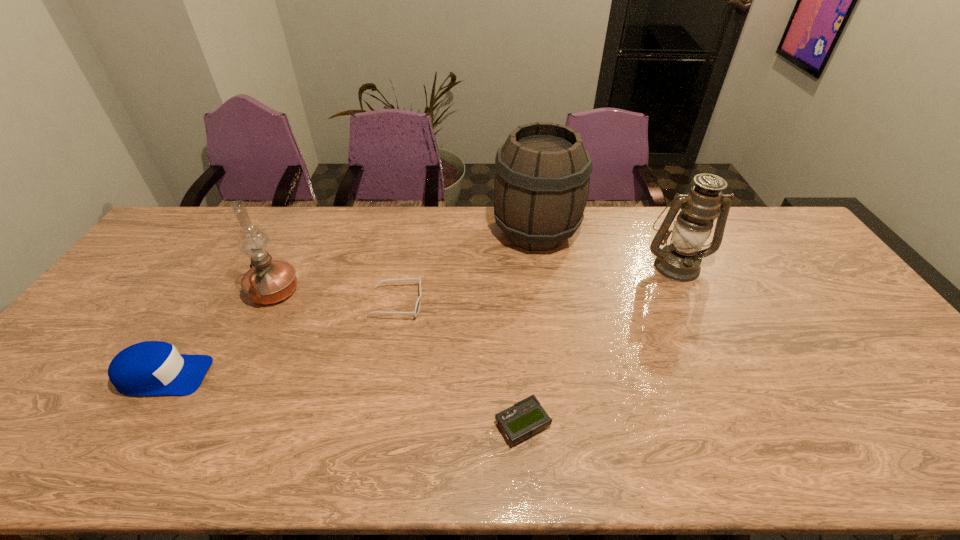
Where is `vacant space at the right edge of the desktop`? This screenshot has width=960, height=540. vacant space at the right edge of the desktop is located at coordinates (895, 401).

I want to click on free point at the far left corner, so [x=182, y=231].

I want to click on vacant space at the far right corner of the desktop, so (758, 243).

The width and height of the screenshot is (960, 540). Find the location of `free point between the third object from left to right and the fourth tallest object`. free point between the third object from left to right and the fourth tallest object is located at coordinates (280, 339).

This screenshot has height=540, width=960. Find the location of `vacant area between the rightmost object and the wine bucket`. vacant area between the rightmost object and the wine bucket is located at coordinates tap(606, 249).

Find the location of `vacant space that is in between the left oil lamp and the wine bucket`. vacant space that is in between the left oil lamp and the wine bucket is located at coordinates (405, 262).

What are the coordinates of `free space between the second shortest object and the right oil lamp` in the screenshot? It's located at (537, 284).

This screenshot has width=960, height=540. What are the coordinates of `free point between the sunglasses and the shortest object` in the screenshot? It's located at pyautogui.click(x=460, y=363).

What are the coordinates of `blank region between the nearest object and the left oil lamp` in the screenshot? It's located at (398, 357).

I want to click on empty space between the wine bucket and the left oil lamp, so click(x=405, y=262).